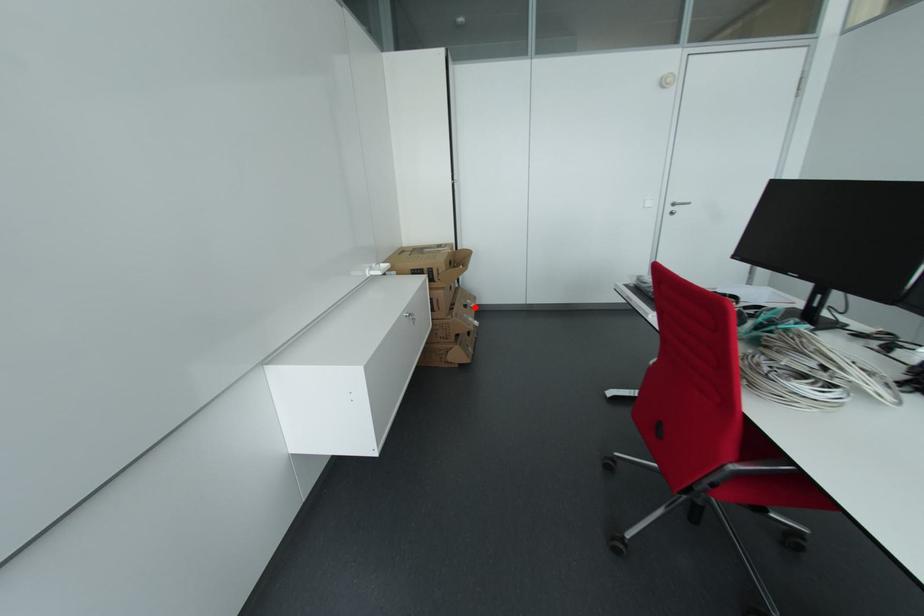
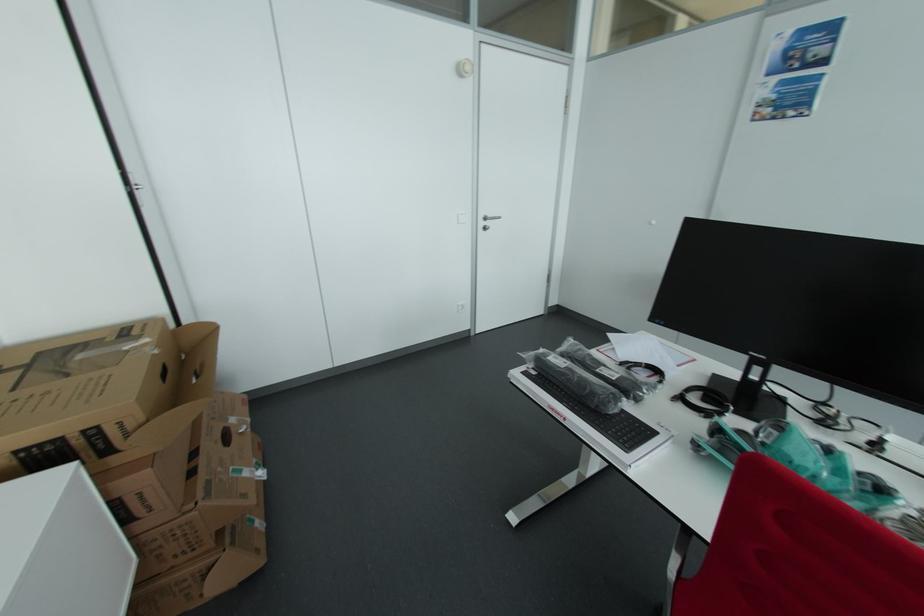
Where in the second image is the point corresponding to the highlighted location from the first image?

(245, 432)